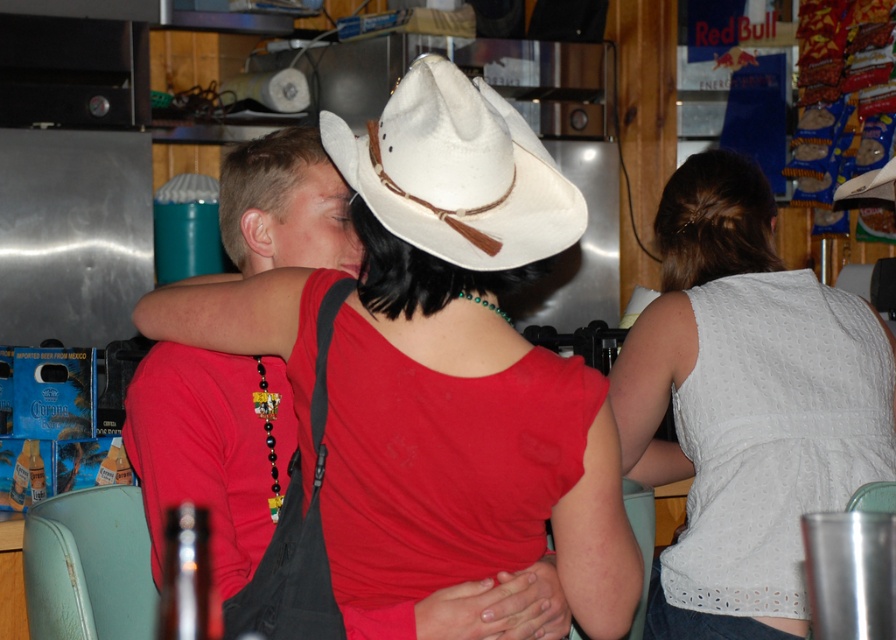
You are a photographer standing at the back of the diner. You want to capture a photo of the matte black shirt at center and the white felt cowboy hat at center without any obstruction between them. Given that your camera has a focal length of 50mm, can you estimate if the two objects are within the same frame?

The distance between the matte black shirt at center and the white felt cowboy hat at center is 10.79 inches, which is relatively close. With a 50mm focal length, the two objects are likely within the same frame as they are positioned near each other at the center of the scene.

You are a photographer trying to capture a closeup shot of the white lace tank top at center and the white felt cowboy hat at center. Since you want to focus on the tank top, which object should you position closer to the camera?

The white lace tank top at center has a greater height compared to the white felt cowboy hat at center, so to focus on the tank top, position it closer to the camera.

In the scene shown: You are a photographer trying to capture a portrait of both individuals at the table. Since the matte black shirt at center and the white lace tank top at center are both at the center, which one is blocking the view of the other?

The matte black shirt at center is behind the white lace tank top at center, so the white lace tank top at center is blocking the view of the matte black shirt at center.